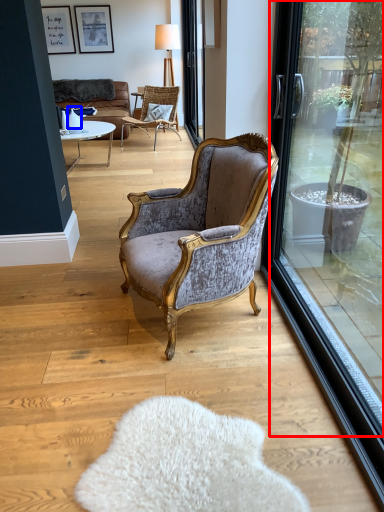
Question: Which point is closer to the camera, window screen (highlighted by a red box) or vase (highlighted by a blue box)?

Choices:
 (A) window screen
 (B) vase

Answer: (A)